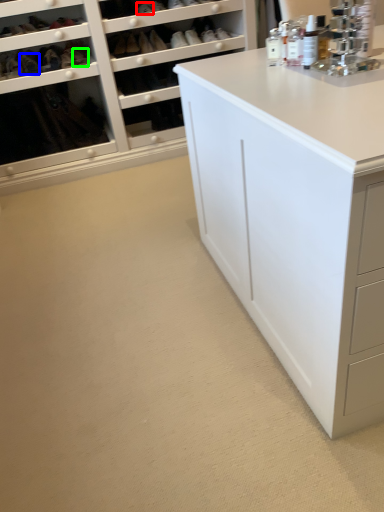
Question: Based on their relative distances, which object is farther from shoe (highlighted by a red box)? Choose from shoe (highlighted by a blue box) and shoe (highlighted by a green box).

Choices:
 (A) shoe
 (B) shoe

Answer: (A)